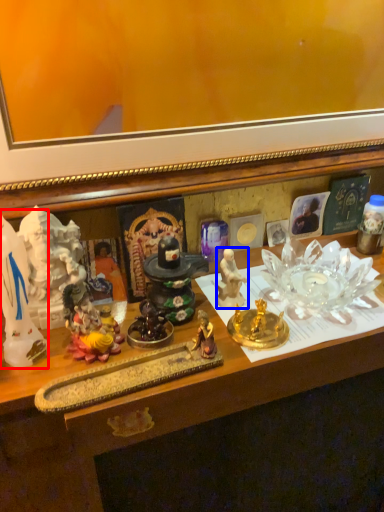
Question: Which object appears closest to the camera in this image, toy (highlighted by a red box) or person (highlighted by a blue box)?

Choices:
 (A) toy
 (B) person

Answer: (A)